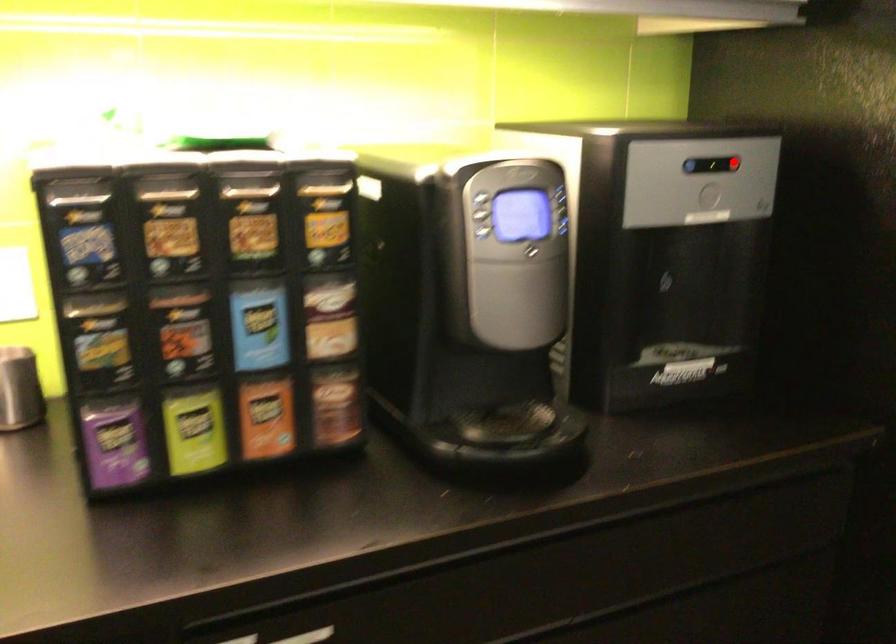
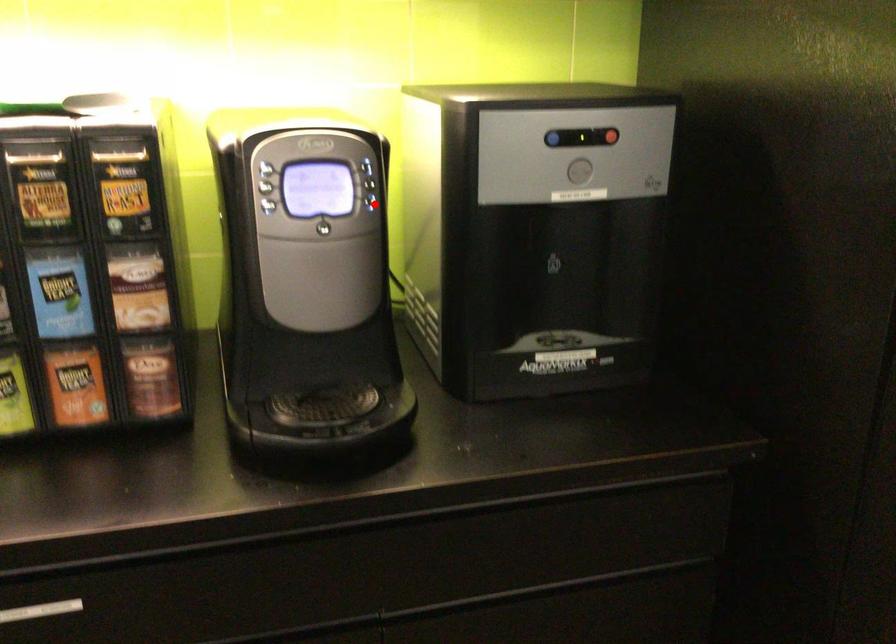
I am providing you with two images of the same scene from different viewpoints. A red point is marked on the first image and another point is marked on the second image. Is the marked point in image1 the same physical position as the marked point in image2?

No